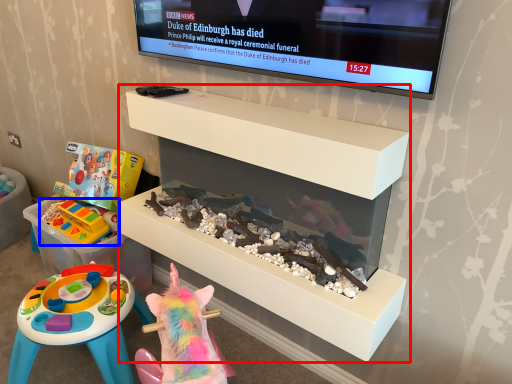
Question: Which object is closer to the camera taking this photo, furniture (highlighted by a red box) or toy (highlighted by a blue box)?

Choices:
 (A) furniture
 (B) toy

Answer: (A)